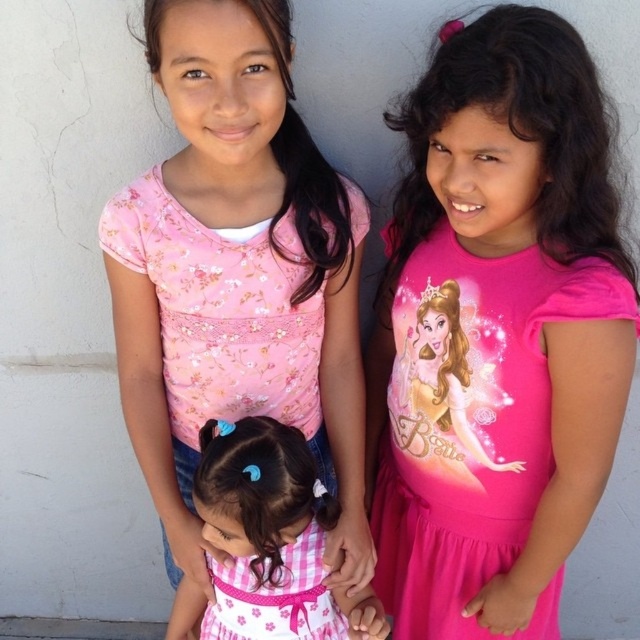
Question: Does pink floral shirt at center appear on the right side of pink cotton dress at center?

Choices:
 (A) no
 (B) yes

Answer: (A)

Question: Is pink checkered dress at center positioned in front of pink cotton dress at center?

Choices:
 (A) yes
 (B) no

Answer: (A)

Question: Which point is farther to the camera?

Choices:
 (A) (504, 497)
 (B) (132, 440)
 (C) (250, 579)
 (D) (339, 620)

Answer: (D)

Question: Which point appears closest to the camera in this image?

Choices:
 (A) (236, 45)
 (B) (284, 468)

Answer: (A)

Question: Does pink floral shirt at center appear over pink satin dress at center?

Choices:
 (A) no
 (B) yes

Answer: (B)

Question: Which of the following is the closest to the observer?

Choices:
 (A) pink checkered dress at center
 (B) pink satin dress at center

Answer: (B)